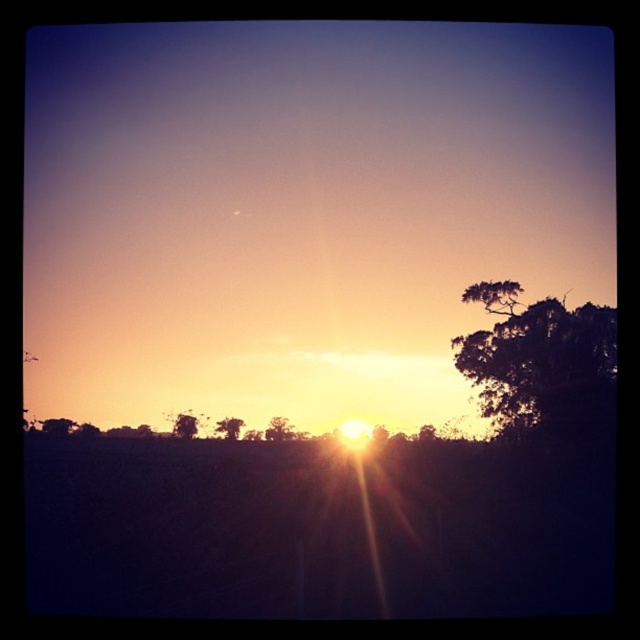
Question: Which of the following is the farthest from the observer?

Choices:
 (A) (273, 417)
 (B) (67, 422)
 (C) (188, 435)

Answer: (A)

Question: Which of the following is the closest to the observer?

Choices:
 (A) (269, 424)
 (B) (481, 380)

Answer: (A)

Question: Estimate the real-world distances between objects in this image. Which object is farther from the dark green leafy tree at right?

Choices:
 (A) green leafy tree at center
 (B) brown textured tree at center
 (C) green matte tree at center

Answer: (C)

Question: Does green leafy tree at center have a larger size compared to green matte tree at center?

Choices:
 (A) yes
 (B) no

Answer: (A)

Question: Is green leafy tree at lower left smaller than brown textured tree at center?

Choices:
 (A) no
 (B) yes

Answer: (A)

Question: Can you confirm if green leafy tree at lower left is thinner than brown textured tree at center?

Choices:
 (A) no
 (B) yes

Answer: (A)